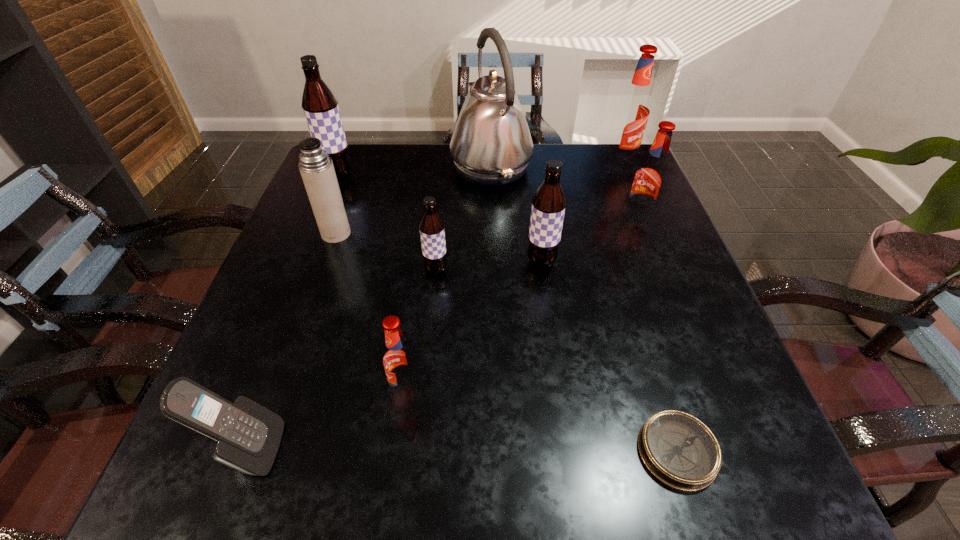
The image size is (960, 540). What are the coordinates of `the nearest root beer` in the screenshot? It's located at (399, 360).

This screenshot has width=960, height=540. Identify the location of the second brown root beer from left to right. (432, 232).

This screenshot has width=960, height=540. What are the coordinates of `cellular telephone` in the screenshot? It's located at (248, 435).

What are the coordinates of `compass` in the screenshot? It's located at (678, 449).

I want to click on free spot located 0.180m on the left of the kettle, so click(384, 167).

This screenshot has height=540, width=960. I want to click on vacant space located 0.210m on the right of the biggest brown root beer, so click(x=433, y=175).

This screenshot has width=960, height=540. In order to click on blank area located on the front of the farthest red root beer in this screenshot , I will do `click(656, 246)`.

The image size is (960, 540). In order to click on vacant space located 0.200m on the back of the second smallest red root beer in this screenshot , I will do `click(616, 165)`.

Identify the location of vacant area located 0.310m on the left of the fourth root beer from left to right. (380, 261).

I want to click on vacant space located on the front of the thermos bottle, so click(279, 398).